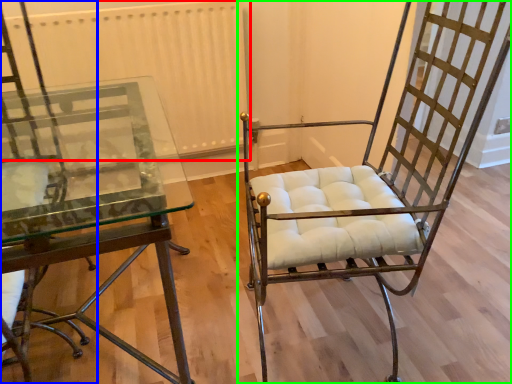
Question: Based on their relative distances, which object is nearer to radiator (highlighted by a red box)? Choose from chair (highlighted by a blue box) and chair (highlighted by a green box).

Choices:
 (A) chair
 (B) chair

Answer: (A)